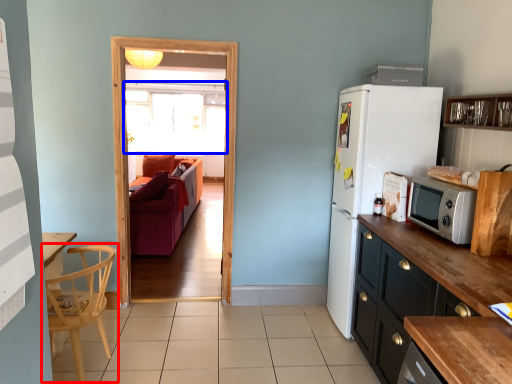
Question: Which object is closer to the camera taking this photo, chair (highlighted by a red box) or window (highlighted by a blue box)?

Choices:
 (A) chair
 (B) window

Answer: (A)